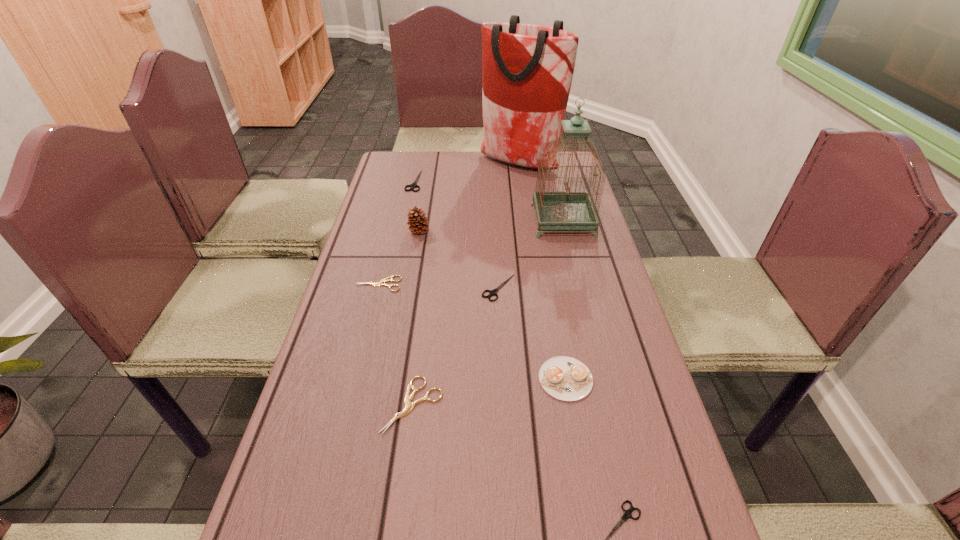
The height and width of the screenshot is (540, 960). What are the coordinates of `the tallest object` in the screenshot? It's located at (527, 70).

Where is `red grocery bag`? This screenshot has height=540, width=960. red grocery bag is located at coordinates (527, 70).

Locate an element on the screen. birdcage is located at coordinates (556, 210).

Identify the location of the eighth shortest object. This screenshot has width=960, height=540. (556, 210).

This screenshot has width=960, height=540. What are the coordinates of `pinecone` in the screenshot? It's located at (417, 223).

This screenshot has height=540, width=960. In order to click on white cappuccino in this screenshot , I will do `click(565, 378)`.

Where is `the fourth tallest object`? The image size is (960, 540). the fourth tallest object is located at coordinates (565, 378).

Identify the location of the leftmost black shears. This screenshot has width=960, height=540. (414, 185).

In order to click on the farthest black shears in this screenshot , I will do `click(414, 185)`.

Find the location of a particular element. Image resolution: width=960 pixels, height=540 pixels. the second biggest black shears is located at coordinates (493, 292).